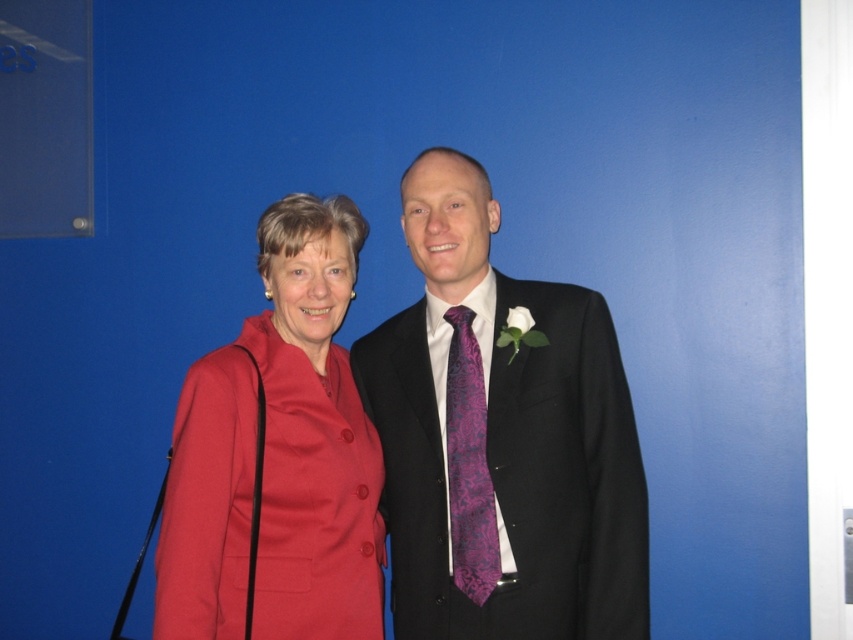
Question: Is matte red coat at center bigger than purple textured tie at center?

Choices:
 (A) no
 (B) yes

Answer: (B)

Question: Does matte black suit at center come behind purple textured tie at center?

Choices:
 (A) yes
 (B) no

Answer: (B)

Question: Which point appears closest to the camera in this image?

Choices:
 (A) (331, 545)
 (B) (418, 195)

Answer: (A)

Question: Estimate the real-world distances between objects in this image. Which object is farther from the purple textured tie at center?

Choices:
 (A) matte black suit at center
 (B) matte red coat at center

Answer: (B)

Question: Considering the real-world distances, which object is farthest from the matte red coat at center?

Choices:
 (A) matte black suit at center
 (B) purple textured tie at center

Answer: (B)

Question: Is the position of matte red coat at center less distant than that of purple textured tie at center?

Choices:
 (A) no
 (B) yes

Answer: (B)